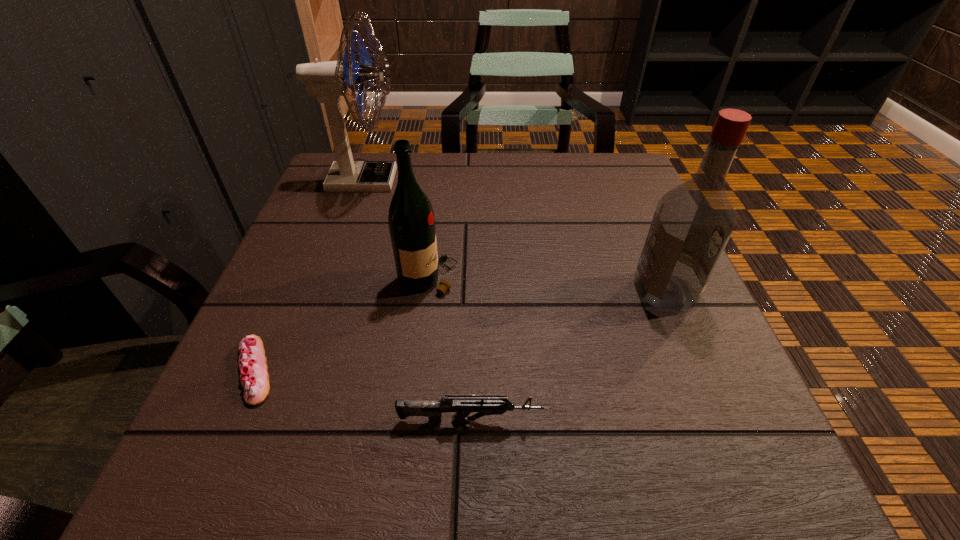
Where is `free area in between the liquor and the gun`? free area in between the liquor and the gun is located at coordinates (569, 356).

In order to click on free space between the shortest object and the third tallest object in this screenshot , I will do [x=342, y=325].

Image resolution: width=960 pixels, height=540 pixels. Find the location of `vacant area that lies between the liquor and the shortest object`. vacant area that lies between the liquor and the shortest object is located at coordinates (460, 331).

Identify which object is located as the nearest to the second shortest object. Please provide its 2D coordinates. Your answer should be formatted as a tuple, i.e. [(x, y)], where the tuple contains the x and y coordinates of a point satisfying the conditions above.

[(252, 363)]

Point out which object is positioned as the third nearest to the fan. Please provide its 2D coordinates. Your answer should be formatted as a tuple, i.e. [(x, y)], where the tuple contains the x and y coordinates of a point satisfying the conditions above.

[(464, 404)]